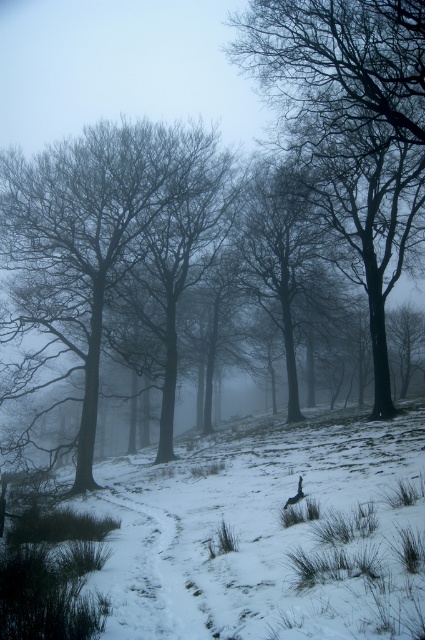
You are an explorer navigating through the winter landscape. You see the silvery bark trees at center and the snowy dirt path at center. Which object is positioned to the left of the other?

The silvery bark trees at center are to the left of the snowy dirt path at center.

You are an explorer trying to navigate through the winter landscape. You need to determine which object at the center of the image is larger. Which one is bigger between the silvery bark trees at center and the snowy dirt path at center?

The silvery bark trees at center is bigger than the snowy dirt path at center according to the description.

You are an artist trying to paint the winter scene. You notice two types of trees at the center of the image. Which of the two trees, the smooth bark tree at center or the silvery bark trees at center, would require fewer brushstrokes to paint due to its size?

The smooth bark tree at center occupies less space than the silvery bark trees at center, so it would require fewer brushstrokes to paint due to its smaller size.